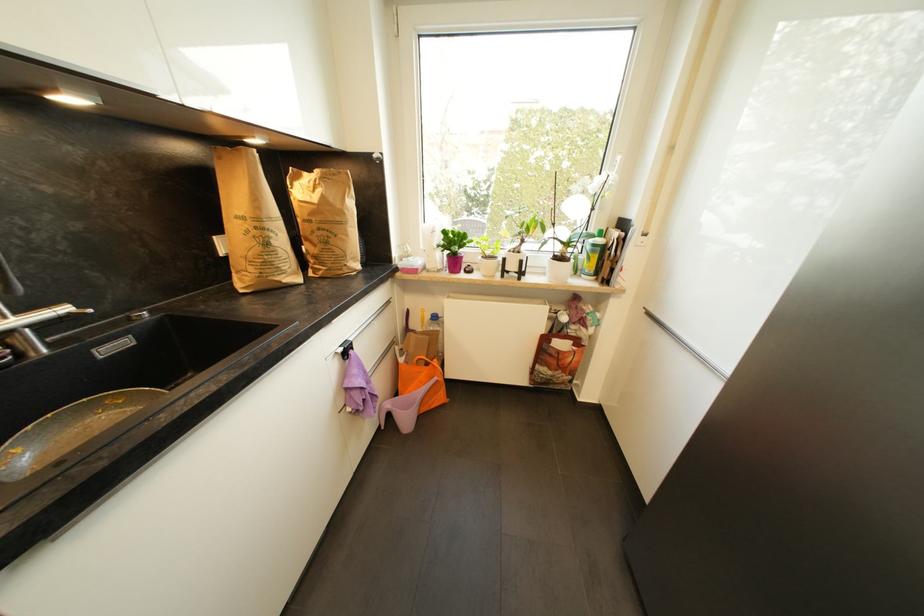
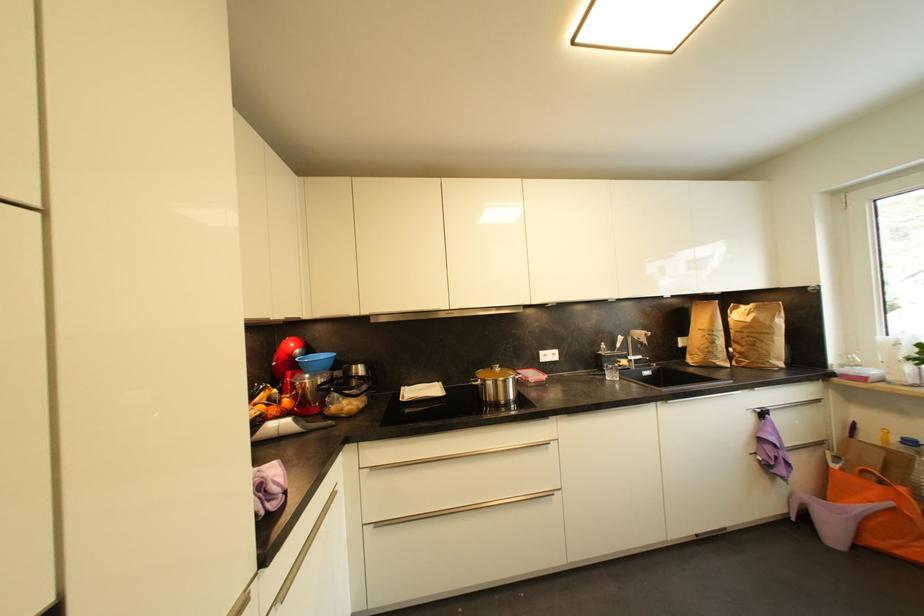
Where in the second image is the point corresponding to the point at 397,345 from the first image?

(825, 446)